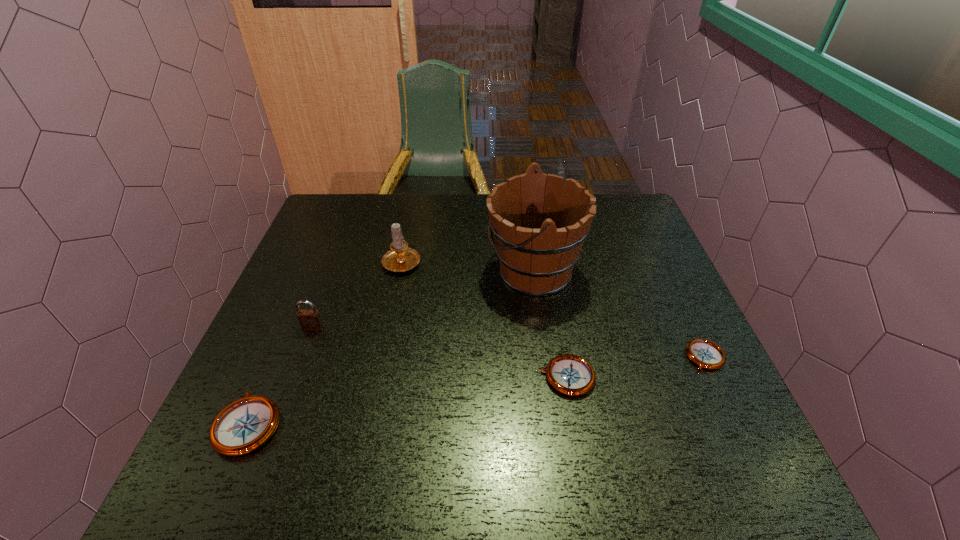
Please point a location where one more compass can be added evenly. Please provide its 2D coordinates. Your answer should be formatted as a tuple, i.e. [(x, y)], where the tuple contains the x and y coordinates of a point satisfying the conditions above.

[(415, 400)]